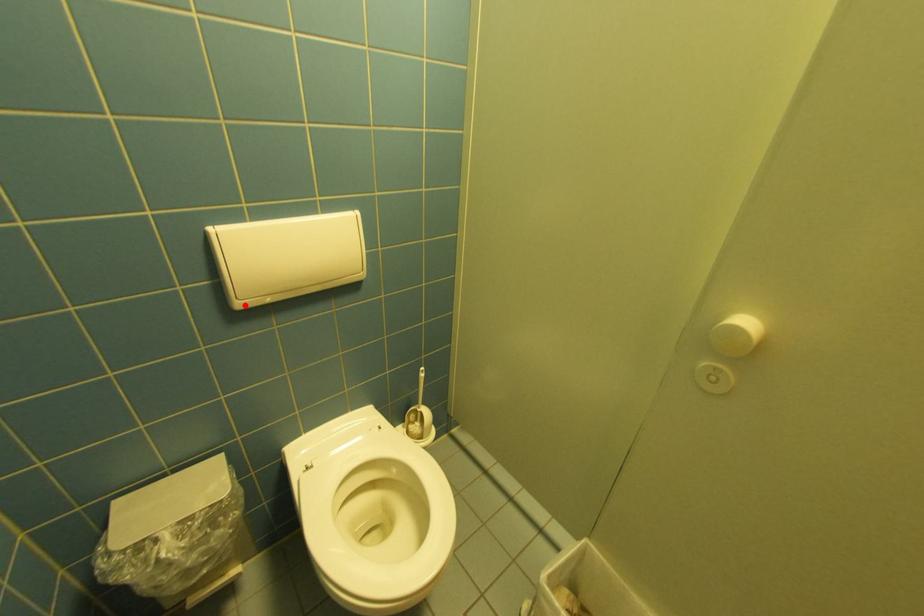
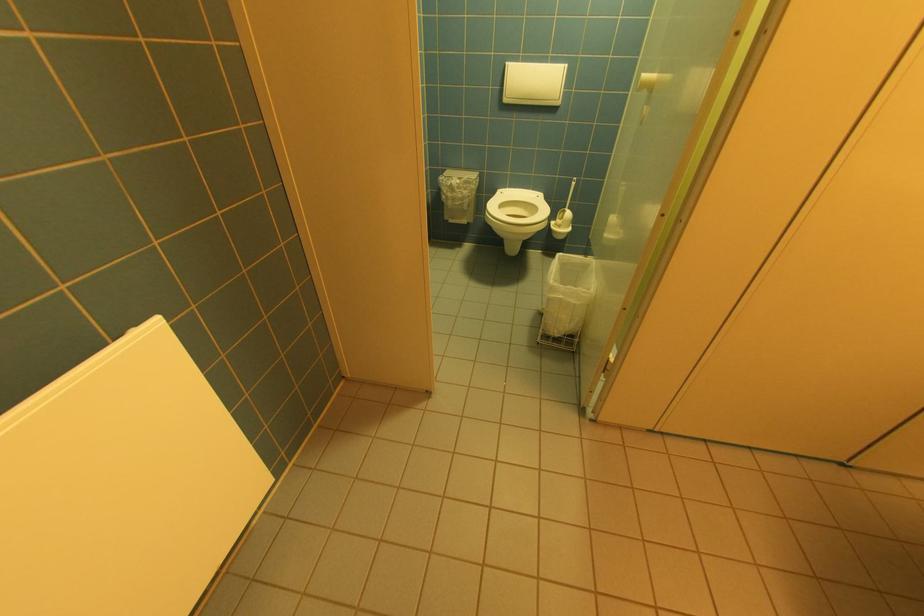
Question: I am providing you with two images of the same scene from different viewpoints. In image1, a red point is highlighted. Considering the same 3D point in image2, which of the following is correct?

Choices:
 (A) It is closer
 (B) It is farther

Answer: (B)